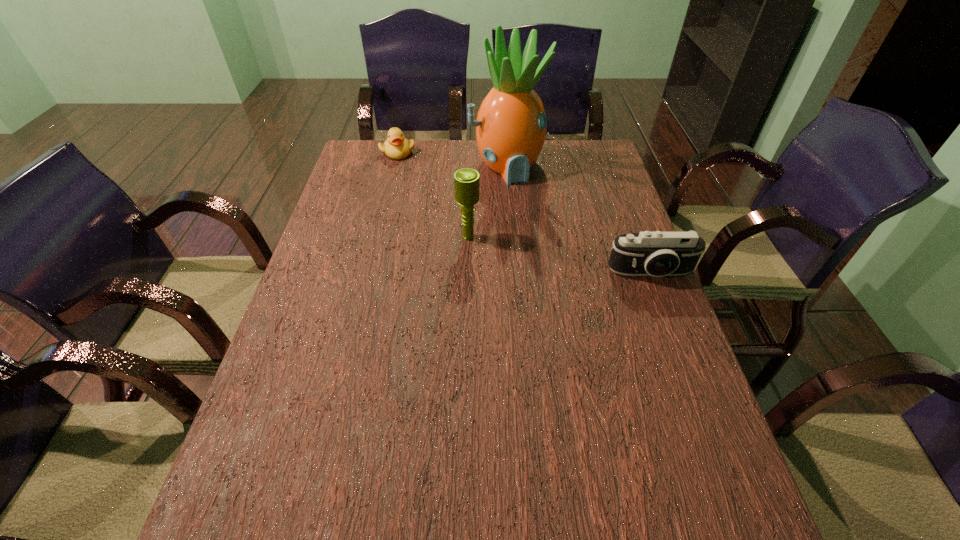
Identify the location of free space on the desktop that is between the third farthest object and the rightmost object and is positioned at the entrance of the tallest object. The image size is (960, 540). (564, 255).

The width and height of the screenshot is (960, 540). I want to click on free space on the desktop that is between the third shortest object and the rightmost object and is positioned on the front-facing side of the leftmost object, so click(540, 251).